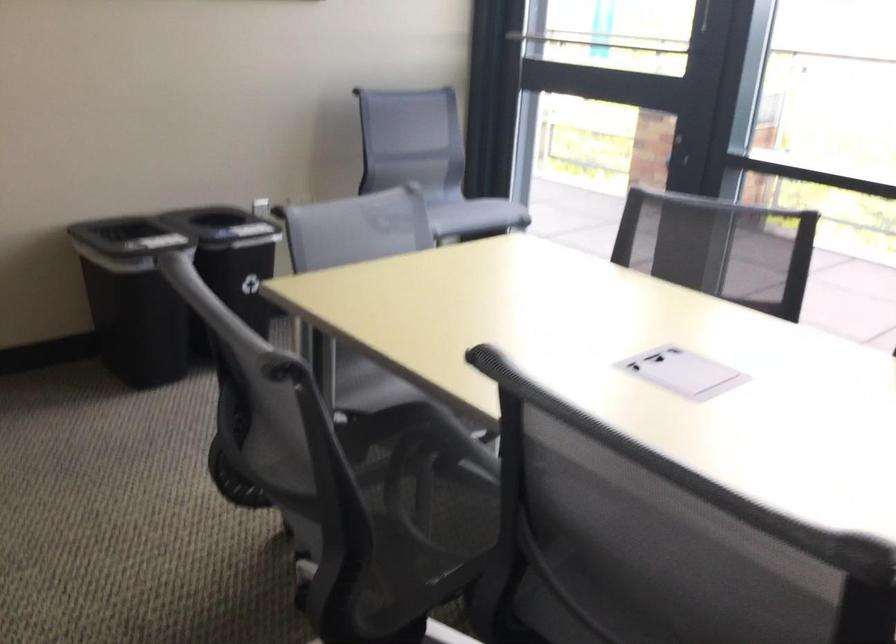
What do you see at coordinates (682, 79) in the screenshot? The height and width of the screenshot is (644, 896). I see `a black door handle` at bounding box center [682, 79].